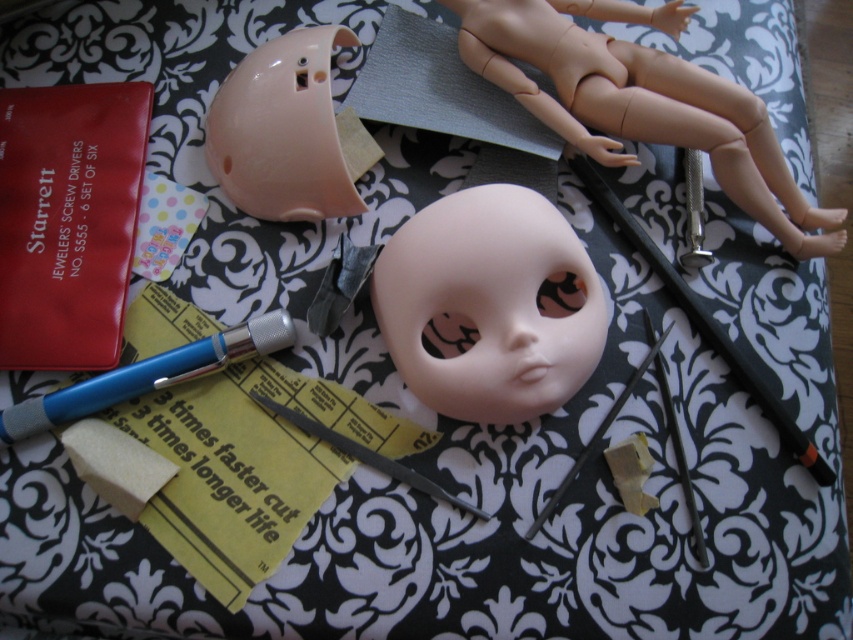
Between smooth beige doll at upper right and matte plastic helmet at upper center, which one has more height?

smooth beige doll at upper right

Between point (759, 182) and point (259, 125), which one is positioned behind?

Positioned behind is point (759, 182).

Where is `smooth beige doll at upper right`? This screenshot has width=853, height=640. smooth beige doll at upper right is located at coordinates (642, 100).

Who is lower down, matte plastic doll head at center or smooth beige doll at upper right?

matte plastic doll head at center

Does matte plastic doll head at center have a lesser width compared to smooth beige doll at upper right?

Indeed, matte plastic doll head at center has a lesser width compared to smooth beige doll at upper right.

Locate an element on the screen. matte plastic doll head at center is located at coordinates (489, 305).

Is the position of matte plastic doll head at center more distant than that of matte plastic helmet at upper center?

No, it is in front of matte plastic helmet at upper center.

Consider the image. Who is lower down, matte plastic doll head at center or matte plastic helmet at upper center?

matte plastic doll head at center is lower down.

Which is in front, point (374, 278) or point (287, 188)?

Point (374, 278) is in front.

This screenshot has width=853, height=640. I want to click on matte plastic doll head at center, so click(x=489, y=305).